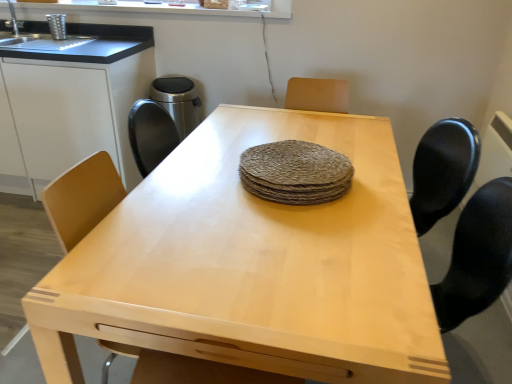
Question: Looking at their shapes, would you say rough woven placemat at center is wider or thinner than light wood table at center?

Choices:
 (A) wide
 (B) thin

Answer: (B)

Question: Does point [x=262, y=150] appear closer or farther from the camera than point [x=351, y=124]?

Choices:
 (A) farther
 (B) closer

Answer: (B)

Question: Which of these objects is positioned farthest from the light wood table at center?

Choices:
 (A) rough woven placemat at center
 (B) white matte cabinet at left

Answer: (B)

Question: Estimate the real-world distances between objects in this image. Which object is closer to the rough woven placemat at center?

Choices:
 (A) light wood table at center
 (B) white matte cabinet at left

Answer: (A)